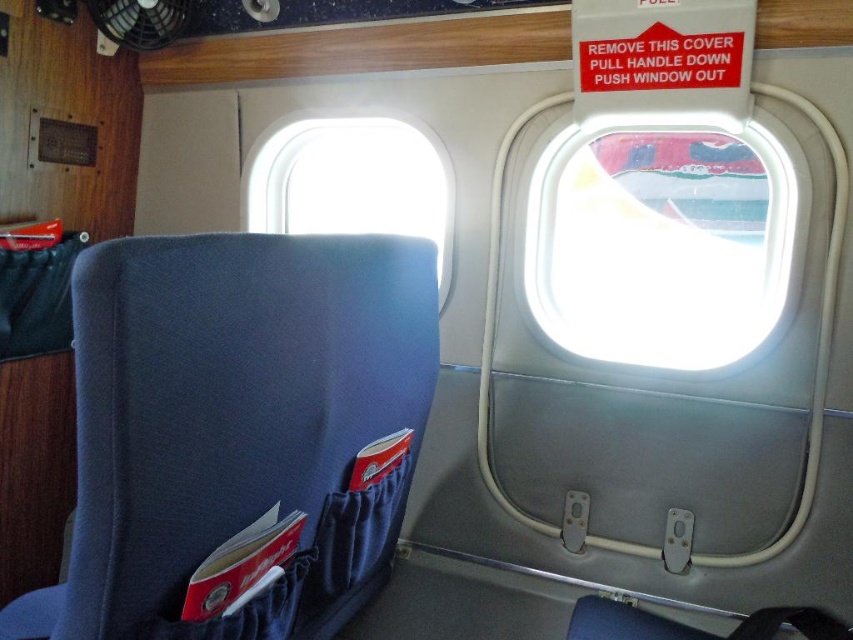
You are seated in the aircraft cabin and need to locate the transparent plastic airplane window at upper right. According to the coordinates provided, where exactly is it positioned?

The transparent plastic airplane window at upper right is positioned at point (662, 241).

You are a flight attendant checking the cabin. You notice the transparent plastic airplane window at upper right and the blue fabric airplane window at upper center. Which one is closer to the passengers sitting in the seat?

The transparent plastic airplane window at upper right is closer to the passengers sitting in the seat because it is in front of the blue fabric airplane window at upper center.